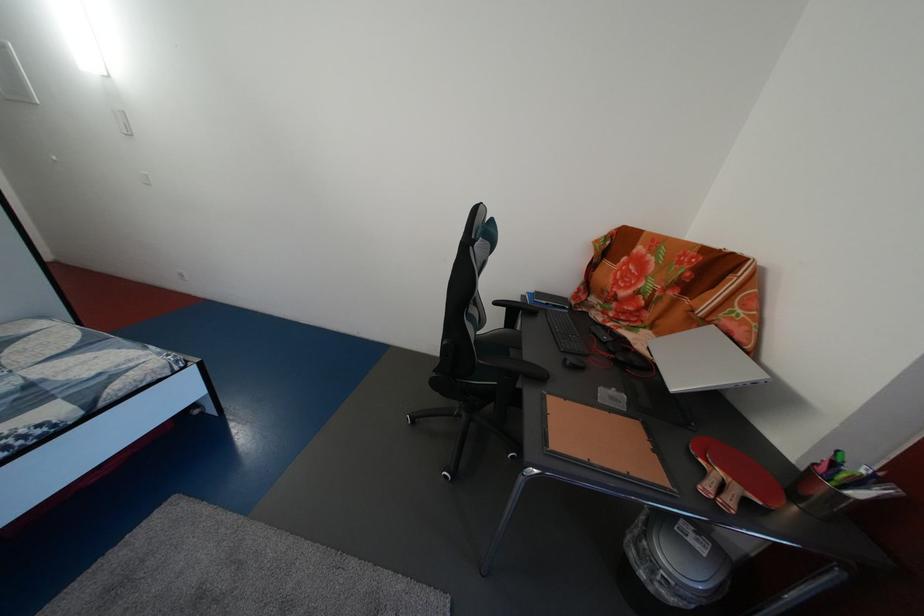
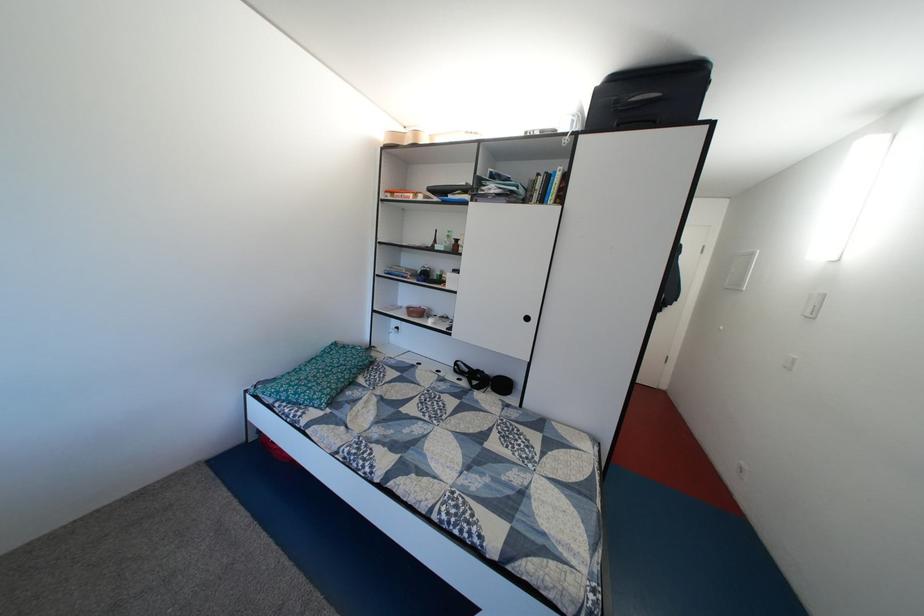
Question: Based on the continuous images, in which direction is the camera rotating? Reply with the corresponding letter.

Choices:
 (A) Left
 (B) Right
 (C) Up
 (D) Down

Answer: (A)